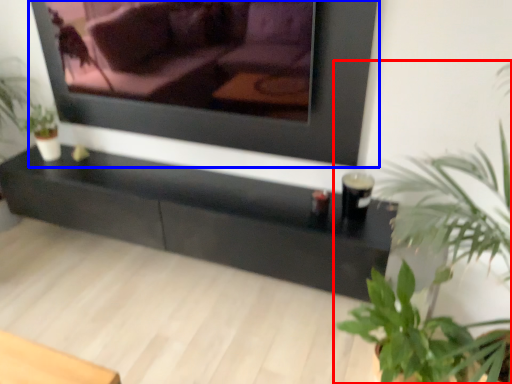
Question: Which of the following is the farthest to the observer, houseplant (highlighted by a red box) or picture frame (highlighted by a blue box)?

Choices:
 (A) houseplant
 (B) picture frame

Answer: (B)